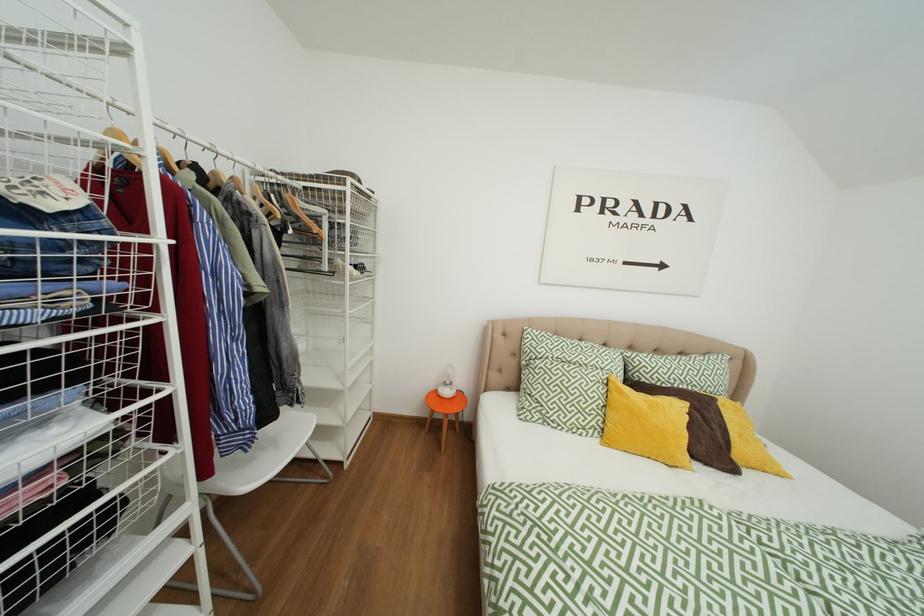
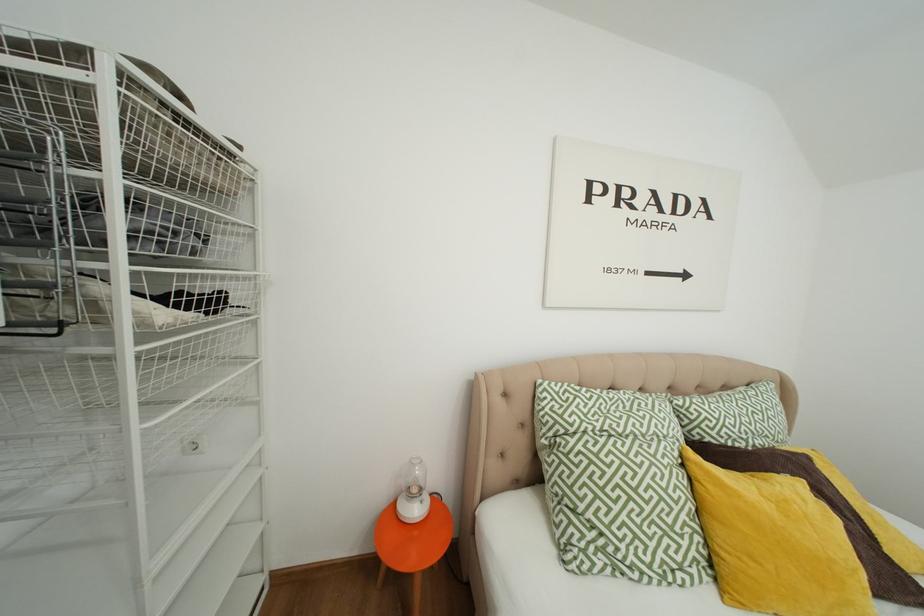
Question: In a continuous first-person perspective shot, in which direction is the camera moving?

Choices:
 (A) Left
 (B) Right
 (C) Forward
 (D) Backward

Answer: (C)